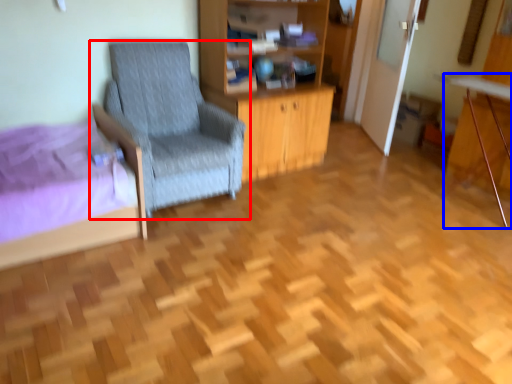
Question: Among these objects, which one is nearest to the camera, chair (highlighted by a red box) or computer desk (highlighted by a blue box)?

Choices:
 (A) chair
 (B) computer desk

Answer: (A)